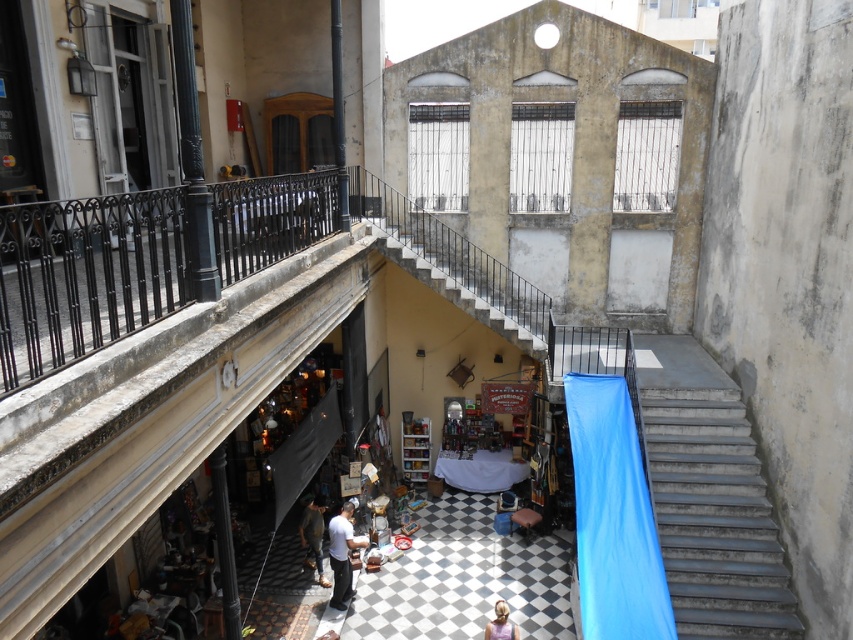
Question: Estimate the real-world distances between objects in this image. Which object is farther from the denim pants at lower center?

Choices:
 (A) checkerboard tile floor at center
 (B) light brown leather pants at center
 (C) light brown hair at lower center
 (D) metallic gray stairs at right

Answer: (D)

Question: Among these objects, which one is farthest from the camera?

Choices:
 (A) checkerboard tile floor at center
 (B) denim pants at lower center
 (C) light brown hair at lower center
 (D) light brown leather pants at center

Answer: (B)

Question: Which object appears closest to the camera in this image?

Choices:
 (A) denim pants at lower center
 (B) checkerboard tile floor at center
 (C) light brown leather pants at center

Answer: (B)

Question: Is checkerboard tile floor at center smaller than light brown hair at lower center?

Choices:
 (A) no
 (B) yes

Answer: (A)

Question: Can you confirm if checkerboard tile floor at center is smaller than light brown leather pants at center?

Choices:
 (A) yes
 (B) no

Answer: (B)

Question: Does metallic gray stairs at right have a greater width compared to light brown leather pants at center?

Choices:
 (A) yes
 (B) no

Answer: (A)